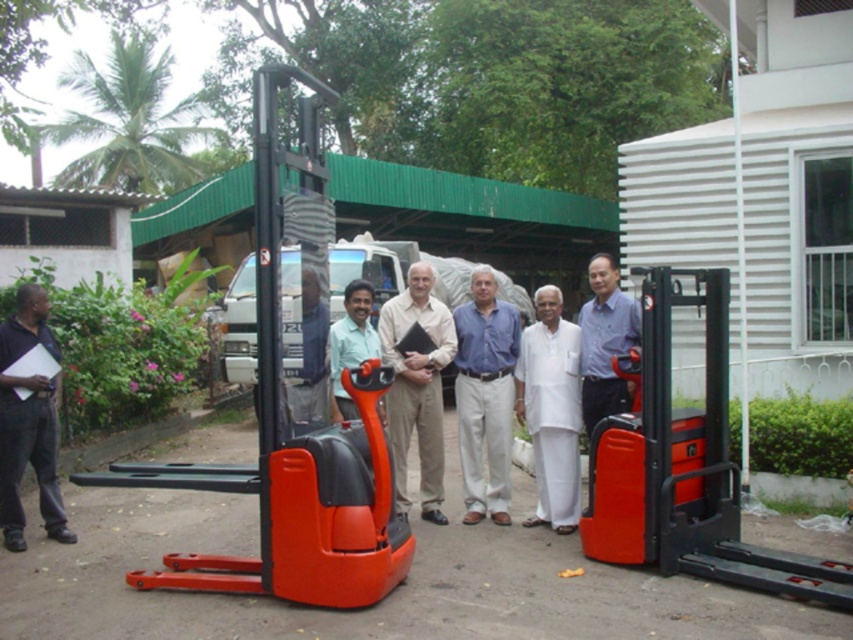
You are an event planner observing the outdoor scene. You need to ensure that the white cotton kurta at center and the orange plastic lift at center are visible to all attendees. Since the orange plastic lift is blocking the view of the white cotton kurta, how would you adjust their positions to improve visibility?

The white cotton kurta at center is located below the orange plastic lift at center. To improve visibility, move the orange plastic lift at center upwards or lower the white cotton kurta at center so that the kurta is no longer obscured by the lift.